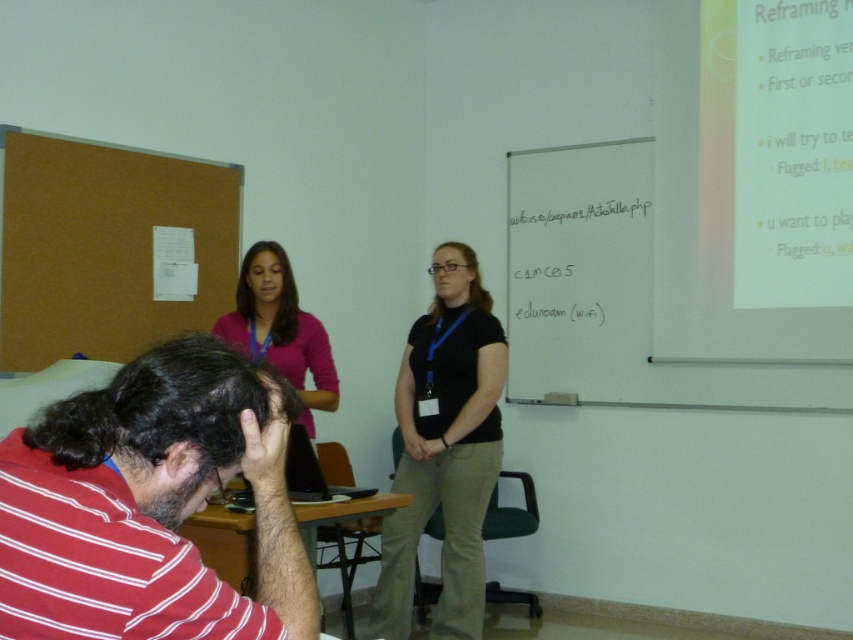
Based on the coordinates provided, which object in the scene is located at point (149, 504)?

The point (149, 504) corresponds to the red striped shirt at lower left.

Based on the classroom scene, which object is closer to the viewer between the red striped shirt at lower left and the pink fabric shirt at upper center?

The red striped shirt at lower left is closer to the viewer because it is positioned in front of the pink fabric shirt at upper center.

You are a student trying to write a note on the whiteboard at right and the black matte shirt at center. Which object is larger in size?

The whiteboard at right is bigger than the black matte shirt at center.